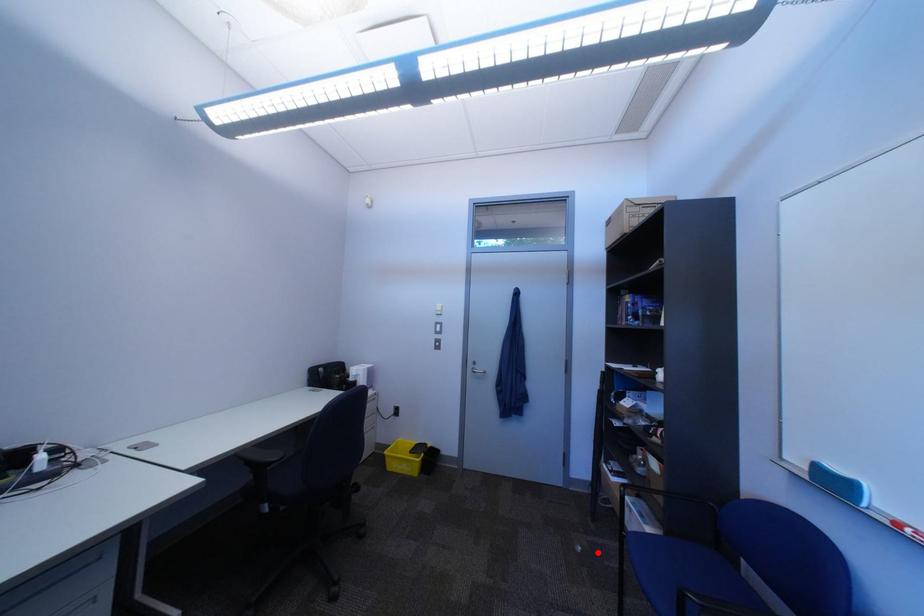
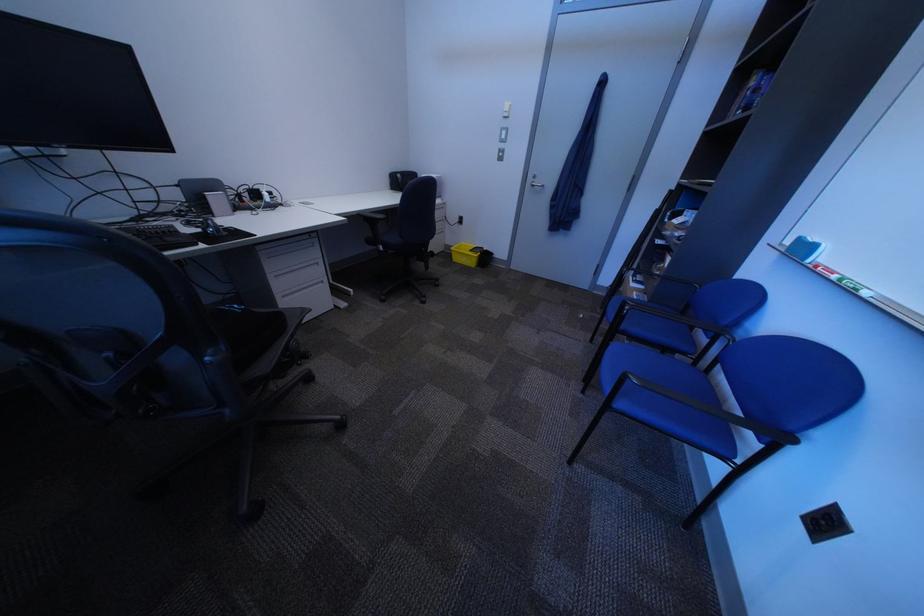
Locate, in the second image, the point that corresponds to the highlighted location in the first image.

(599, 318)